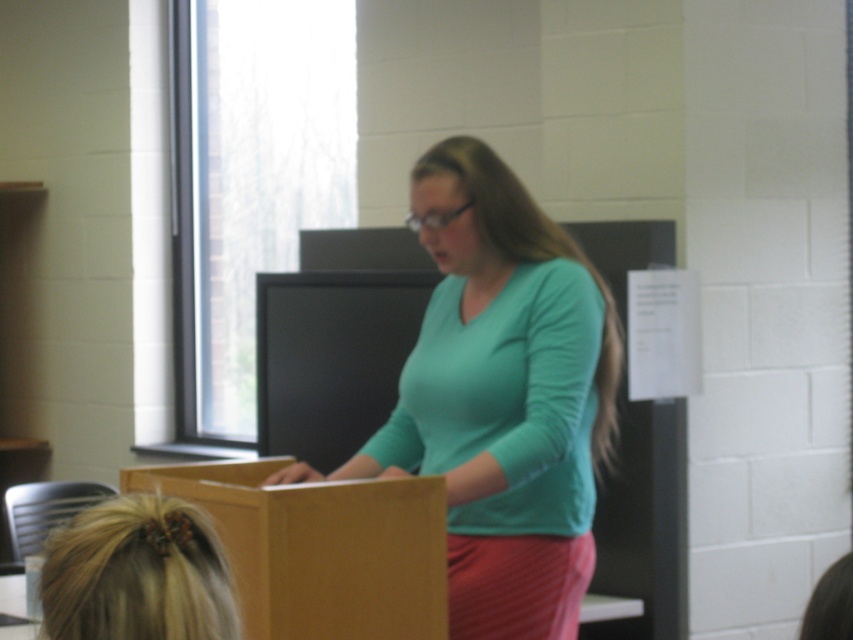
Question: Which of the following is the farthest from the observer?

Choices:
 (A) blonde hair at lower left
 (B) matte brown cardboard box at center

Answer: (B)

Question: Which object appears farthest from the camera in this image?

Choices:
 (A) matte brown cardboard box at center
 (B) teal matte shirt at center

Answer: (B)

Question: Can you confirm if teal matte shirt at center is thinner than blonde hair at lower left?

Choices:
 (A) no
 (B) yes

Answer: (A)

Question: Can you confirm if teal matte shirt at center is positioned to the left of matte brown cardboard box at center?

Choices:
 (A) yes
 (B) no

Answer: (B)

Question: Which point is closer to the camera?

Choices:
 (A) teal matte shirt at center
 (B) matte brown cardboard box at center

Answer: (B)

Question: Is matte brown cardboard box at center above blonde hair at lower left?

Choices:
 (A) no
 (B) yes

Answer: (A)